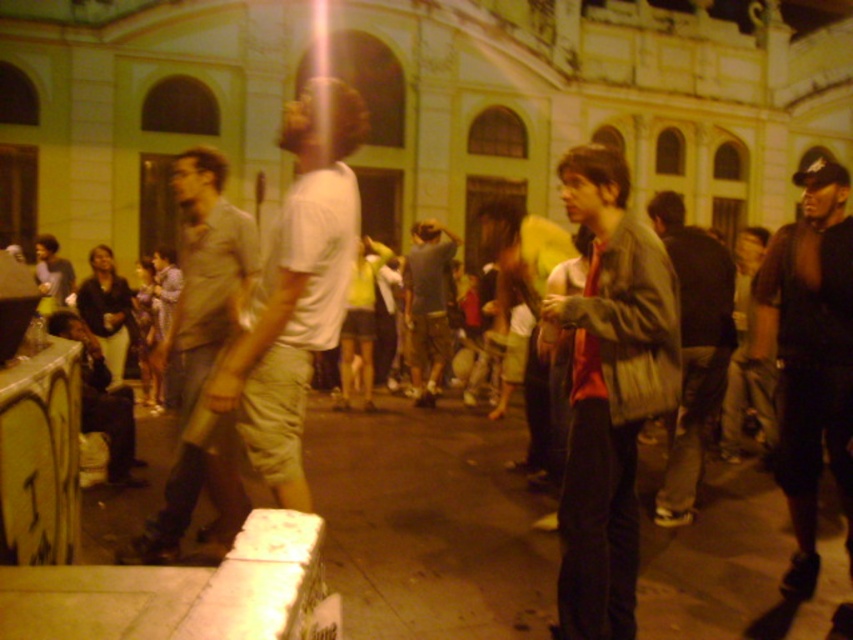
From the picture: You are a photographer trying to capture a group photo of the light brown fabric shirt at center and the matte gray jacket at center. The camera you are using has a maximum focus range of 12 meters. Will you be able to focus on both subjects simultaneously?

The distance between the light brown fabric shirt at center and the matte gray jacket at center is 13.98 meters, which exceeds the camera maximum focus range of 12 meters. Therefore, you cannot focus on both subjects simultaneously.

Based on the coordinates provided, which object is located at point (x=294, y=291) in the scene?

The point (x=294, y=291) corresponds to the white cotton t shirt at center.

You are at a nighttime event and need to decide which jacket to take with you. The matte brown jacket at center and the black leather jacket at right are both available. Which jacket is shorter in height?

The matte brown jacket at center is shorter than the black leather jacket at right.